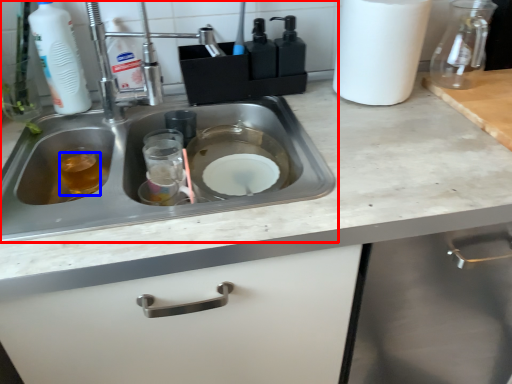
Question: Which of the following is the closest to the observer, sink (highlighted by a red box) or liquid (highlighted by a blue box)?

Choices:
 (A) sink
 (B) liquid

Answer: (A)